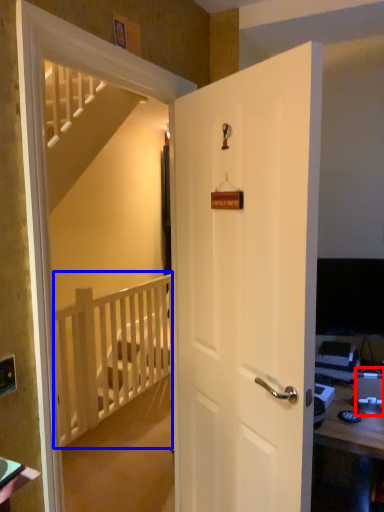
Question: Which object appears farthest to the camera in this image, desktop computer (highlighted by a red box) or balustrade (highlighted by a blue box)?

Choices:
 (A) desktop computer
 (B) balustrade

Answer: (B)